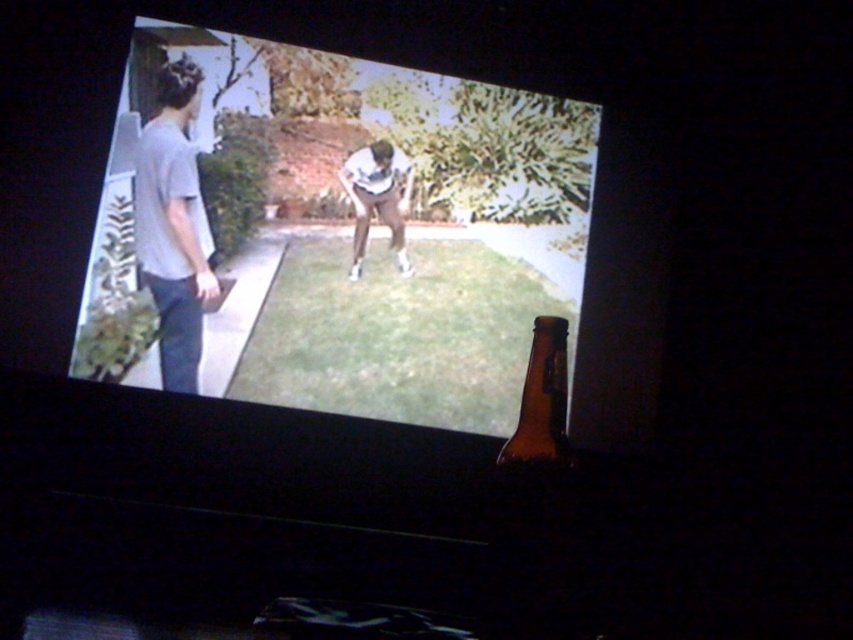
Question: Which point is closer to the camera?

Choices:
 (A) light gray fabric pants at center
 (B) gray cotton t-shirt at left
 (C) brown glass bottle at lower right

Answer: (C)

Question: In this image, where is gray cotton t-shirt at left located relative to brown glass bottle at lower right?

Choices:
 (A) above
 (B) below

Answer: (A)

Question: From the image, what is the correct spatial relationship of gray cotton t-shirt at left in relation to light gray fabric pants at center?

Choices:
 (A) above
 (B) below

Answer: (B)

Question: Which point is farther to the camera?

Choices:
 (A) light gray fabric pants at center
 (B) brown glass bottle at lower right

Answer: (A)

Question: Which point appears farthest from the camera in this image?

Choices:
 (A) (387, 189)
 (B) (544, 426)

Answer: (A)

Question: From the image, what is the correct spatial relationship of brown glass bottle at lower right in relation to light gray fabric pants at center?

Choices:
 (A) above
 (B) below

Answer: (B)